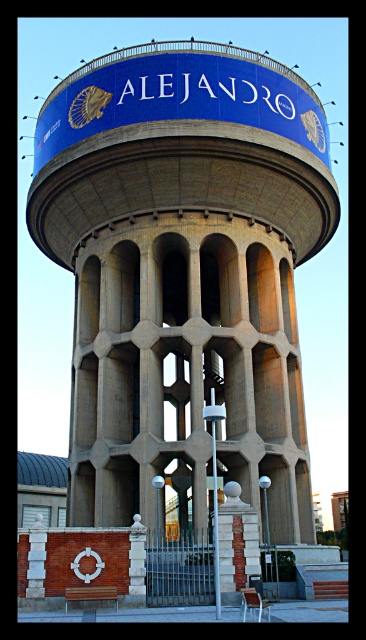
You are standing at the point with coordinates (184, 273) in the image. What object is located exactly at this point?

The concrete water tower at center is located exactly at point (184, 273).

You are standing in front of the water tower and want to touch both the concrete water tower at center and the brick textured column at center. Which one would you reach first?

The concrete water tower at center is closer to you than the brick textured column at center, so you would reach it first.

You are a city planner assessing the height of structures in the area. Given the scene, which object is significantly taller between the concrete water tower at center and the brick textured column at center?

The concrete water tower at center is much taller than the brick textured column at center according to the description.